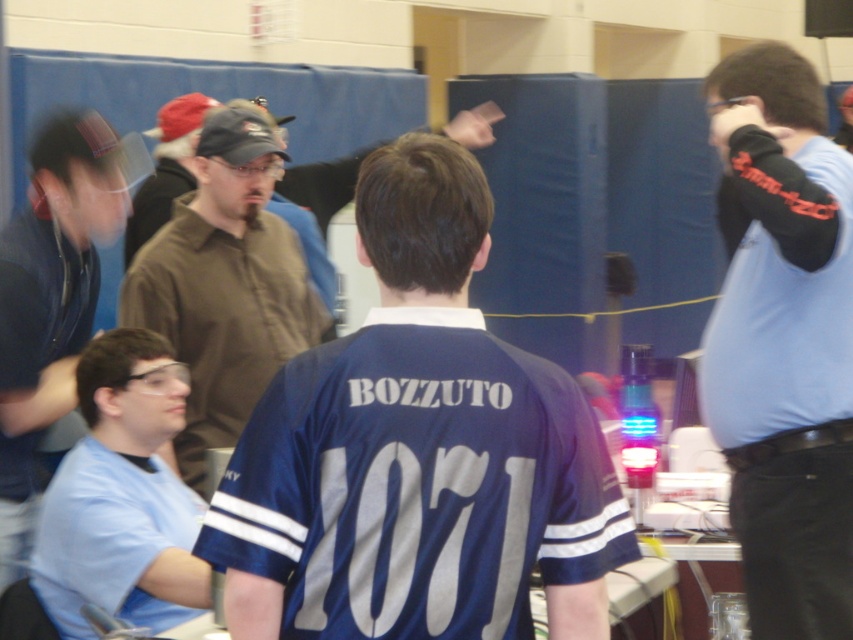
Question: Which point is farther to the camera?

Choices:
 (A) light blue shirt at lower left
 (B) blue jersey at center

Answer: (A)

Question: Is blue jersey at center further to the viewer compared to matte black shirt at left?

Choices:
 (A) no
 (B) yes

Answer: (A)

Question: Which point is closer to the camera?

Choices:
 (A) blue jersey at center
 (B) light blue shirt at lower left
 (C) matte black shirt at left

Answer: (A)

Question: Which of these objects is positioned closest to the brown matte shirt at upper center?

Choices:
 (A) light blue shirt at lower left
 (B) matte black shirt at left
 (C) light blue shirt at right

Answer: (B)

Question: Is brown matte shirt at upper center behind light blue shirt at lower left?

Choices:
 (A) no
 (B) yes

Answer: (B)

Question: Does blue jersey at center have a larger size compared to light blue shirt at lower left?

Choices:
 (A) yes
 (B) no

Answer: (B)